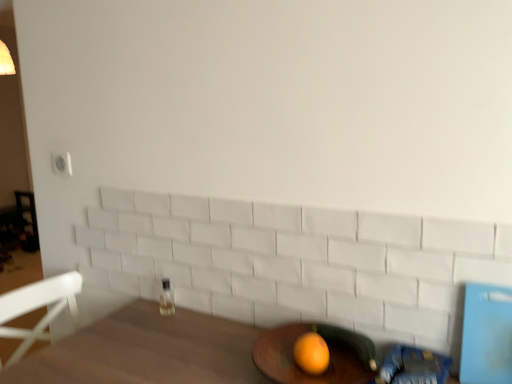
Question: From the image's perspective, is wooden round table at lower center under clear glass bottle at center?

Choices:
 (A) yes
 (B) no

Answer: (A)

Question: Can you confirm if wooden round table at lower center is taller than clear glass bottle at center?

Choices:
 (A) yes
 (B) no

Answer: (B)

Question: Can you confirm if wooden round table at lower center is wider than clear glass bottle at center?

Choices:
 (A) yes
 (B) no

Answer: (A)

Question: Does wooden round table at lower center contain clear glass bottle at center?

Choices:
 (A) no
 (B) yes

Answer: (A)

Question: From a real-world perspective, is wooden round table at lower center physically above clear glass bottle at center?

Choices:
 (A) no
 (B) yes

Answer: (A)

Question: Considering the positions of clear glass bottle at center and orange matte at lower center in the image, is clear glass bottle at center bigger or smaller than orange matte at lower center?

Choices:
 (A) small
 (B) big

Answer: (A)

Question: From the image's perspective, relative to orange matte at lower center, is clear glass bottle at center above or below?

Choices:
 (A) above
 (B) below

Answer: (A)

Question: Considering their positions, is clear glass bottle at center located in front of or behind orange matte at lower center?

Choices:
 (A) behind
 (B) front

Answer: (A)

Question: Looking at their shapes, would you say clear glass bottle at center is wider or thinner than orange matte at lower center?

Choices:
 (A) thin
 (B) wide

Answer: (A)

Question: From the image's perspective, is wooden round table at lower center located above or below orange matte at lower center?

Choices:
 (A) above
 (B) below

Answer: (B)

Question: Does point (354, 360) appear closer or farther from the camera than point (320, 372)?

Choices:
 (A) farther
 (B) closer

Answer: (A)

Question: In the image, is wooden round table at lower center positioned in front of or behind orange matte at lower center?

Choices:
 (A) front
 (B) behind

Answer: (A)

Question: Looking at the image, does wooden round table at lower center seem bigger or smaller compared to orange matte at lower center?

Choices:
 (A) big
 (B) small

Answer: (A)

Question: Is point (317, 337) closer or farther from the camera than point (287, 372)?

Choices:
 (A) farther
 (B) closer

Answer: (A)

Question: From their relative heights in the image, would you say orange matte at lower center is taller or shorter than wooden round table at lower center?

Choices:
 (A) tall
 (B) short

Answer: (B)